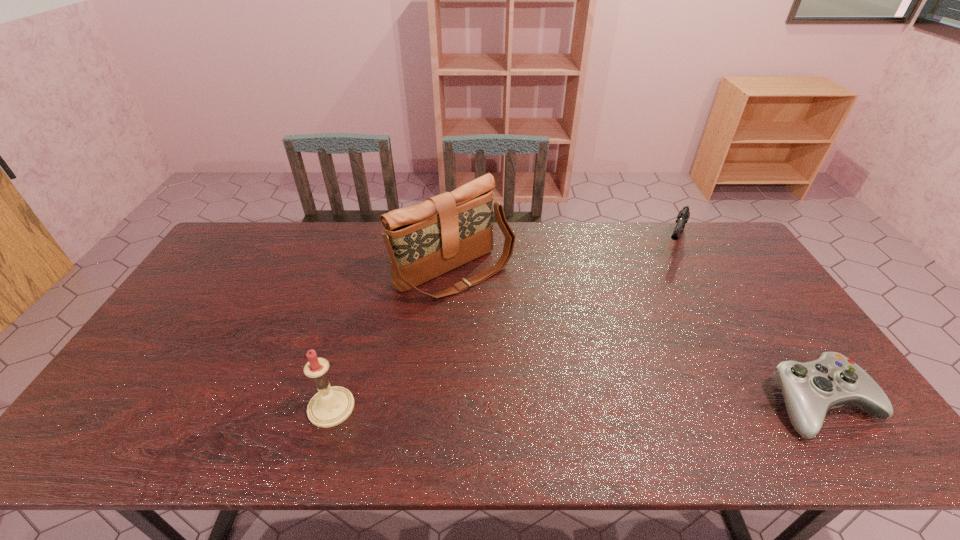
Find the location of `vacant space that satisfies the following two spatial constraints: 1. on the back side of the leftmost object; 2. on the left side of the third tallest object`. vacant space that satisfies the following two spatial constraints: 1. on the back side of the leftmost object; 2. on the left side of the third tallest object is located at coordinates (378, 244).

This screenshot has height=540, width=960. Find the location of `free space that satisfies the following two spatial constraints: 1. on the back side of the gun; 2. on the right side of the candle`. free space that satisfies the following two spatial constraints: 1. on the back side of the gun; 2. on the right side of the candle is located at coordinates (378, 244).